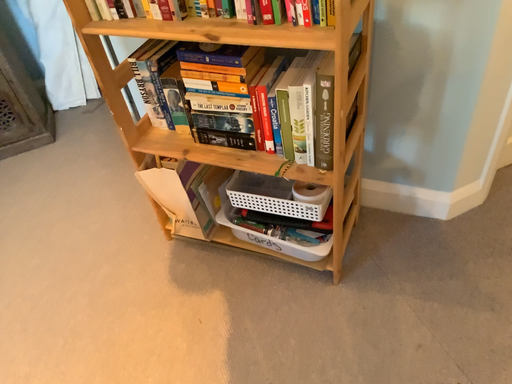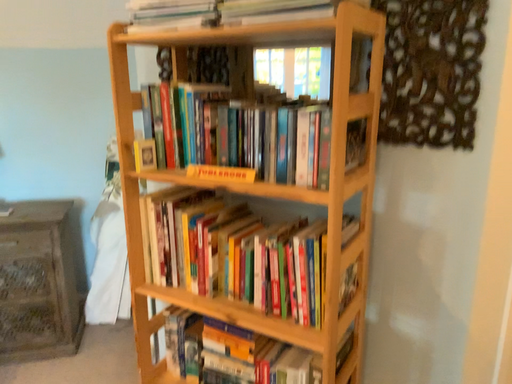
Question: How did the camera likely rotate when shooting the video?

Choices:
 (A) rotated upward
 (B) rotated downward

Answer: (A)